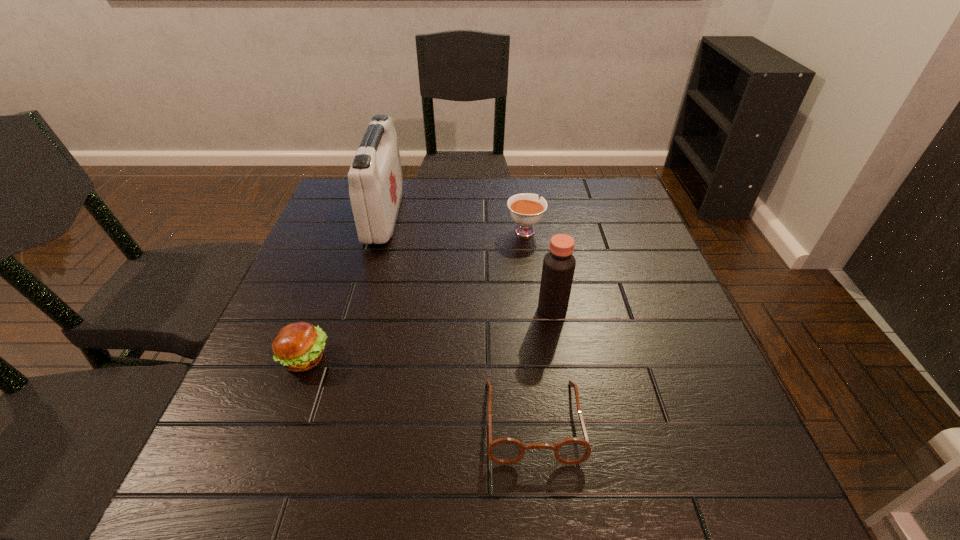
I want to click on the first-aid kit, so click(x=375, y=178).

Find the location of a particular element. The image size is (960, 540). vinegar is located at coordinates (559, 264).

Where is `the third nearest object`? Image resolution: width=960 pixels, height=540 pixels. the third nearest object is located at coordinates (559, 264).

Identify the location of teacup. (526, 209).

This screenshot has width=960, height=540. In order to click on hamburger in this screenshot , I will do `click(299, 347)`.

This screenshot has width=960, height=540. Identify the location of the shortest object. [505, 451].

Find the location of a particular element. the nearest object is located at coordinates (505, 451).

The width and height of the screenshot is (960, 540). I want to click on free spot located 0.100m on the front side of the first-aid kit, so click(x=433, y=216).

Where is `vacant point located 0.050m on the left of the third nearest object`? The width and height of the screenshot is (960, 540). vacant point located 0.050m on the left of the third nearest object is located at coordinates (516, 309).

This screenshot has width=960, height=540. I want to click on free space located 0.100m on the side of the teacup with the handle, so [x=521, y=199].